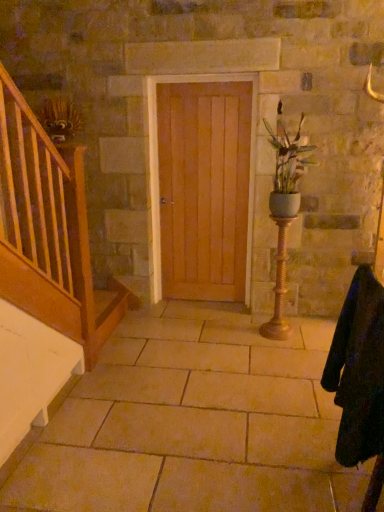
Question: From the image's perspective, is beige stone floor at center above matte white vase at center right?

Choices:
 (A) no
 (B) yes

Answer: (A)

Question: Is the depth of beige stone floor at center greater than that of matte white vase at center right?

Choices:
 (A) no
 (B) yes

Answer: (A)

Question: Can you confirm if beige stone floor at center is bigger than matte white vase at center right?

Choices:
 (A) yes
 (B) no

Answer: (A)

Question: Does beige stone floor at center have a lesser width compared to matte white vase at center right?

Choices:
 (A) no
 (B) yes

Answer: (A)

Question: Can you confirm if beige stone floor at center is taller than matte white vase at center right?

Choices:
 (A) yes
 (B) no

Answer: (B)

Question: From a real-world perspective, is gold textured candle holder at center right above or below black woolen robe at lower right?

Choices:
 (A) above
 (B) below

Answer: (B)

Question: In the image, is gold textured candle holder at center right positioned in front of or behind black woolen robe at lower right?

Choices:
 (A) behind
 (B) front

Answer: (A)

Question: Considering the positions of gold textured candle holder at center right and black woolen robe at lower right in the image, is gold textured candle holder at center right bigger or smaller than black woolen robe at lower right?

Choices:
 (A) small
 (B) big

Answer: (A)

Question: Looking at their shapes, would you say gold textured candle holder at center right is wider or thinner than black woolen robe at lower right?

Choices:
 (A) wide
 (B) thin

Answer: (B)

Question: In terms of height, does matte white vase at center right look taller or shorter compared to light brown wood door at center?

Choices:
 (A) short
 (B) tall

Answer: (A)

Question: Relative to light brown wood door at center, is matte white vase at center right in front or behind?

Choices:
 (A) front
 (B) behind

Answer: (A)

Question: Is matte white vase at center right inside the boundaries of light brown wood door at center, or outside?

Choices:
 (A) outside
 (B) inside

Answer: (A)

Question: Based on their sizes in the image, would you say matte white vase at center right is bigger or smaller than light brown wood door at center?

Choices:
 (A) big
 (B) small

Answer: (A)

Question: Is beige stone floor at center spatially inside light brown wood door at center, or outside of it?

Choices:
 (A) inside
 (B) outside

Answer: (B)

Question: From a real-world perspective, relative to light brown wood door at center, is beige stone floor at center vertically above or below?

Choices:
 (A) above
 (B) below

Answer: (B)